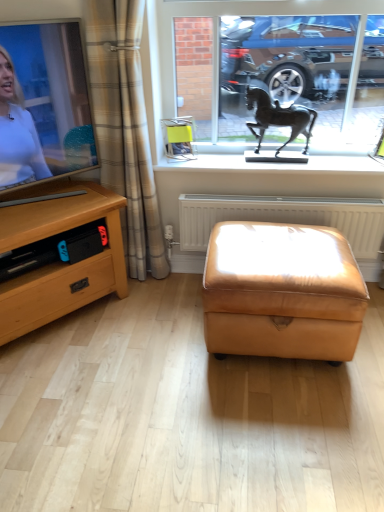
Question: Considering the relative positions of metallic horse statue at upper center and white plastic radiator at center in the image provided, is metallic horse statue at upper center to the right of white plastic radiator at center from the viewer's perspective?

Choices:
 (A) yes
 (B) no

Answer: (B)

Question: Could you tell me if metallic horse statue at upper center is facing white plastic radiator at center?

Choices:
 (A) no
 (B) yes

Answer: (A)

Question: Is white plastic radiator at center inside metallic horse statue at upper center?

Choices:
 (A) yes
 (B) no

Answer: (B)

Question: Does metallic horse statue at upper center have a greater width compared to white plastic radiator at center?

Choices:
 (A) yes
 (B) no

Answer: (B)

Question: Does metallic horse statue at upper center have a smaller size compared to white plastic radiator at center?

Choices:
 (A) no
 (B) yes

Answer: (A)

Question: In terms of height, does white glossy window sill at upper center look taller or shorter compared to bronze horse at center?

Choices:
 (A) short
 (B) tall

Answer: (A)

Question: Based on their sizes in the image, would you say white glossy window sill at upper center is bigger or smaller than bronze horse at center?

Choices:
 (A) big
 (B) small

Answer: (A)

Question: Is white glossy window sill at upper center in front of or behind bronze horse at center in the image?

Choices:
 (A) front
 (B) behind

Answer: (B)

Question: Which is correct: white glossy window sill at upper center is inside bronze horse at center, or outside of it?

Choices:
 (A) inside
 (B) outside

Answer: (B)

Question: Is matte black tv at left spatially inside metallic horse statue at upper center, or outside of it?

Choices:
 (A) outside
 (B) inside

Answer: (A)

Question: Is matte black tv at left to the left or to the right of metallic horse statue at upper center in the image?

Choices:
 (A) left
 (B) right

Answer: (A)

Question: Does point (46, 159) appear closer or farther from the camera than point (206, 30)?

Choices:
 (A) farther
 (B) closer

Answer: (B)

Question: From the image's perspective, relative to metallic horse statue at upper center, is matte black tv at left above or below?

Choices:
 (A) below
 (B) above

Answer: (A)

Question: Would you say bronze horse at center is to the left or to the right of metallic horse statue at upper center in the picture?

Choices:
 (A) left
 (B) right

Answer: (B)

Question: Does point pyautogui.click(x=253, y=101) appear closer or farther from the camera than point pyautogui.click(x=264, y=35)?

Choices:
 (A) farther
 (B) closer

Answer: (A)